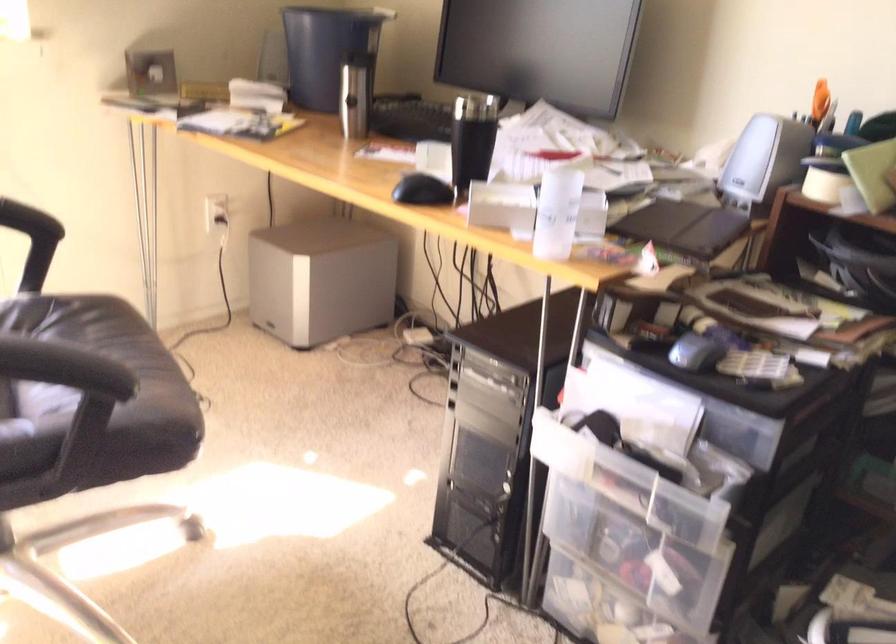
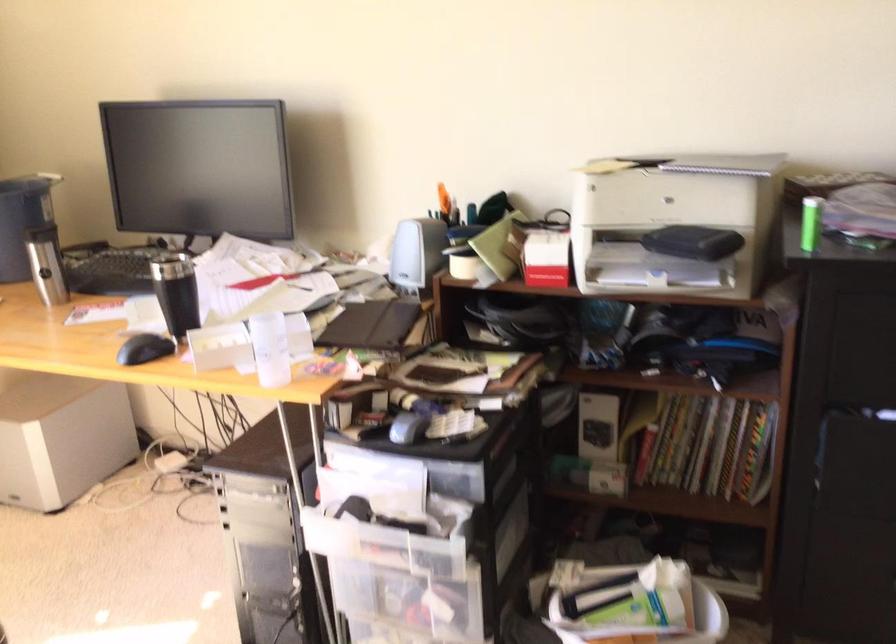
Find the pixel in the second image that matches [553,214] in the first image.

(270, 348)